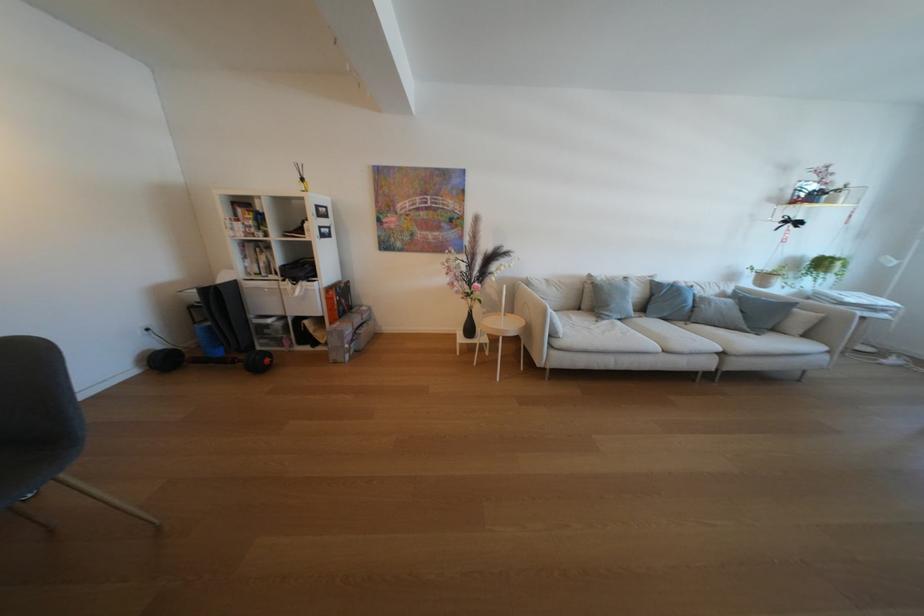
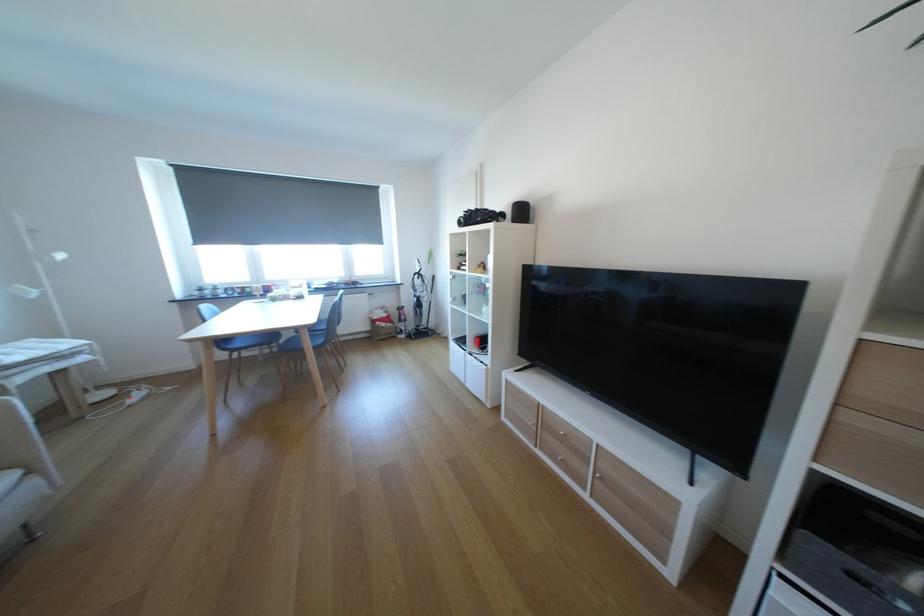
Where in the second image is the point corresponding to [839,358] from the first image?

(45, 483)